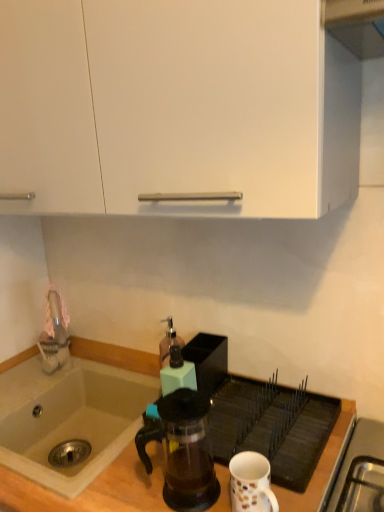
What do you see at coordinates (168, 342) in the screenshot? I see `translucent glass soap dispenser at center, acting as the 1th kitchen appliance starting from the back` at bounding box center [168, 342].

Find the location of a particular element. Image resolution: width=384 pixels, height=512 pixels. translucent glass soap dispenser at center, acting as the 1th kitchen appliance starting from the back is located at coordinates tap(168, 342).

You are a GUI agent. You are given a task and a screenshot of the screen. Output one action in this format:
    pyautogui.click(x=<x>, y=<y>)
    Task: Click on the wooden counter top at lower center
    This screenshot has height=512, width=384.
    Given the screenshot: What is the action you would take?
    pyautogui.click(x=92, y=488)

This screenshot has width=384, height=512. Identify the location of beige ceramic sink at lower left. (74, 412).

You are a GUI agent. You are given a task and a screenshot of the screen. Output one action in this format:
    pyautogui.click(x=<x>, y=<y>)
    Task: Click on the transparent glass coffee maker at center
    This screenshot has width=384, height=512.
    Given the screenshot: What is the action you would take?
    pyautogui.click(x=182, y=449)

Measure the distance between white matte cabinet at upper center and camera.

The distance of white matte cabinet at upper center from camera is 23.27 inches.

What is the approximate width of white matte cabinet at upper center?

white matte cabinet at upper center is 14.98 inches in width.

In order to click on translucent glass soap dispenser at center, acting as the 1th kitchen appliance starting from the back in this screenshot , I will do `click(168, 342)`.

Can you confirm if white matte cabinet at upper center is smaller than beige ceramic sink at lower left?

No, white matte cabinet at upper center is not smaller than beige ceramic sink at lower left.

Who is shorter, white matte cabinet at upper center or beige ceramic sink at lower left?

With less height is beige ceramic sink at lower left.

Is white matte cabinet at upper center thinner than beige ceramic sink at lower left?

Indeed, white matte cabinet at upper center has a lesser width compared to beige ceramic sink at lower left.

Between white matte cabinet at upper center and beige ceramic sink at lower left, which one appears on the right side from the viewer's perspective?

white matte cabinet at upper center is more to the right.

Which point is more forward, (x=172, y=390) or (x=262, y=470)?

The point (x=262, y=470) is closer to the camera.

Can you confirm if matte plastic soap dispenser at center, the 2th kitchen appliance in the back-to-front sequence, is shorter than white ceramic mug at lower right?

No.

From a real-world perspective, which is physically above, matte plastic soap dispenser at center, which is counted as the 1th kitchen appliance, starting from the front, or white ceramic mug at lower right?

matte plastic soap dispenser at center, which is counted as the 1th kitchen appliance, starting from the front.

Is matte plastic soap dispenser at center, which is counted as the 1th kitchen appliance, starting from the front, not near white ceramic mug at lower right?

Actually, matte plastic soap dispenser at center, which is counted as the 1th kitchen appliance, starting from the front, and white ceramic mug at lower right are a little close together.

Identify the location of coffee maker in front of the beige ceramic sink at lower left. Image resolution: width=384 pixels, height=512 pixels. (182, 449).

Which is in front, point (29, 376) or point (183, 475)?

The point (183, 475) is closer.

Is beige ceramic sink at lower left not near transparent glass coffee maker at center?

beige ceramic sink at lower left is actually quite close to transparent glass coffee maker at center.

Is beige ceramic sink at lower left to the left of transparent glass coffee maker at center from the viewer's perspective?

Yes, beige ceramic sink at lower left is to the left of transparent glass coffee maker at center.

Can you confirm if white matte cabinet at upper center is bigger than transparent glass coffee maker at center?

Indeed, white matte cabinet at upper center has a larger size compared to transparent glass coffee maker at center.

Between white matte cabinet at upper center and transparent glass coffee maker at center, which one has less height?

transparent glass coffee maker at center.

Is white matte cabinet at upper center far from transparent glass coffee maker at center?

white matte cabinet at upper center is actually quite close to transparent glass coffee maker at center.

Locate an element on the screen. The image size is (384, 512). cabinetry lying on the left of transparent glass coffee maker at center is located at coordinates (175, 106).

Is beige ceramic sink at lower left wider than wooden counter top at lower center?

No, beige ceramic sink at lower left is not wider than wooden counter top at lower center.

Between beige ceramic sink at lower left and wooden counter top at lower center, which one is positioned behind?

beige ceramic sink at lower left is behind.

Locate an element on the screen. sink above the wooden counter top at lower center (from a real-world perspective) is located at coordinates (74, 412).

Which is closer to the camera, (60, 430) or (152, 490)?

The point (152, 490) is closer to the camera.

In the scene shown: Is matte plastic soap dispenser at center, which is counted as the 1th kitchen appliance, starting from the front, turned away from translucent glass soap dispenser at center, acting as the 1th kitchen appliance starting from the back?

No, matte plastic soap dispenser at center, which is counted as the 1th kitchen appliance, starting from the front,'s orientation is not away from translucent glass soap dispenser at center, acting as the 1th kitchen appliance starting from the back.

In the scene shown: Does matte plastic soap dispenser at center, which is counted as the 1th kitchen appliance, starting from the front, appear on the right side of translucent glass soap dispenser at center, acting as the 1th kitchen appliance starting from the back?

Yes, matte plastic soap dispenser at center, which is counted as the 1th kitchen appliance, starting from the front, is to the right of translucent glass soap dispenser at center, acting as the 1th kitchen appliance starting from the back.

From a real-world perspective, does matte plastic soap dispenser at center, the 2th kitchen appliance in the back-to-front sequence, sit lower than translucent glass soap dispenser at center, acting as the 1th kitchen appliance starting from the back?

Actually, matte plastic soap dispenser at center, the 2th kitchen appliance in the back-to-front sequence, is physically above translucent glass soap dispenser at center, acting as the 1th kitchen appliance starting from the back, in the real world.

Can you tell me how much matte plastic soap dispenser at center, which is counted as the 1th kitchen appliance, starting from the front, and translucent glass soap dispenser at center, arranged as the 2th kitchen appliance when viewed from the front, differ in facing direction?

There is a 5.34-degree angle between the facing directions of matte plastic soap dispenser at center, which is counted as the 1th kitchen appliance, starting from the front, and translucent glass soap dispenser at center, arranged as the 2th kitchen appliance when viewed from the front.

Considering the positions of point (201, 464) and point (73, 399), is point (201, 464) closer or farther from the camera than point (73, 399)?

Clearly, point (201, 464) is closer to the camera than point (73, 399).

Considering the relative positions of transparent glass coffee maker at center and beige ceramic sink at lower left in the image provided, is transparent glass coffee maker at center behind beige ceramic sink at lower left?

No, it is in front of beige ceramic sink at lower left.

Who is smaller, transparent glass coffee maker at center or beige ceramic sink at lower left?

With smaller size is transparent glass coffee maker at center.

Measure the distance from transparent glass coffee maker at center to beige ceramic sink at lower left.

The distance of transparent glass coffee maker at center from beige ceramic sink at lower left is 10.90 inches.

In the image, there is a beige ceramic sink at lower left. Identify the location of cabinetry above it (from the image's perspective). (175, 106).

Which kitchen appliance is the 1st one when counting from the left side of the white ceramic mug at lower right? Please provide its 2D coordinates.

[(177, 373)]

When comparing their distances from matte plastic soap dispenser at center, which is counted as the 1th kitchen appliance, starting from the front, does transparent glass coffee maker at center or wooden counter top at lower center seem closer?

transparent glass coffee maker at center is positioned closer to the anchor matte plastic soap dispenser at center, which is counted as the 1th kitchen appliance, starting from the front.

Which object lies further to the anchor point translucent glass soap dispenser at center, acting as the 1th kitchen appliance starting from the back, transparent glass coffee maker at center or matte plastic soap dispenser at center, which is counted as the 1th kitchen appliance, starting from the front?

Based on the image, transparent glass coffee maker at center appears to be further to translucent glass soap dispenser at center, acting as the 1th kitchen appliance starting from the back.

When comparing their distances from transparent glass coffee maker at center, does white ceramic mug at lower right or beige ceramic sink at lower left seem closer?

white ceramic mug at lower right lies closer to transparent glass coffee maker at center than the other object.

Which object lies nearer to the anchor point wooden counter top at lower center, translucent glass soap dispenser at center, acting as the 1th kitchen appliance starting from the back, or matte plastic soap dispenser at center, the 2th kitchen appliance in the back-to-front sequence?

matte plastic soap dispenser at center, the 2th kitchen appliance in the back-to-front sequence, is positioned closer to the anchor wooden counter top at lower center.

From the image, which object appears to be nearer to white ceramic mug at lower right, translucent glass soap dispenser at center, acting as the 1th kitchen appliance starting from the back, or matte plastic soap dispenser at center, which is counted as the 1th kitchen appliance, starting from the front?

matte plastic soap dispenser at center, which is counted as the 1th kitchen appliance, starting from the front, is closer to white ceramic mug at lower right.

Which object lies further to the anchor point beige ceramic sink at lower left, white matte cabinet at upper center or matte plastic soap dispenser at center, which is counted as the 1th kitchen appliance, starting from the front?

white matte cabinet at upper center.

When comparing their distances from white ceramic mug at lower right, does translucent glass soap dispenser at center, arranged as the 2th kitchen appliance when viewed from the front, or white matte cabinet at upper center seem further?

Among the two, white matte cabinet at upper center is located further to white ceramic mug at lower right.

Which object lies further to the anchor point wooden counter top at lower center, transparent glass coffee maker at center or white ceramic mug at lower right?

white ceramic mug at lower right is further to wooden counter top at lower center.

In order to click on coffee maker between white ceramic mug at lower right and translucent glass soap dispenser at center, arranged as the 2th kitchen appliance when viewed from the front, along the z-axis in this screenshot , I will do `click(182, 449)`.

You are a GUI agent. You are given a task and a screenshot of the screen. Output one action in this format:
    pyautogui.click(x=<x>, y=<y>)
    Task: Click on the kitchen appliance between beige ceramic sink at lower left and matte plastic soap dispenser at center, the 2th kitchen appliance in the back-to-front sequence, from left to right
    Image resolution: width=384 pixels, height=512 pixels.
    Given the screenshot: What is the action you would take?
    pyautogui.click(x=168, y=342)

This screenshot has height=512, width=384. In order to click on counter top located between beige ceramic sink at lower left and white ceramic mug at lower right in the left-right direction in this screenshot , I will do `click(92, 488)`.

Identify the location of coffee cup between white matte cabinet at upper center and beige ceramic sink at lower left vertically. (251, 483).